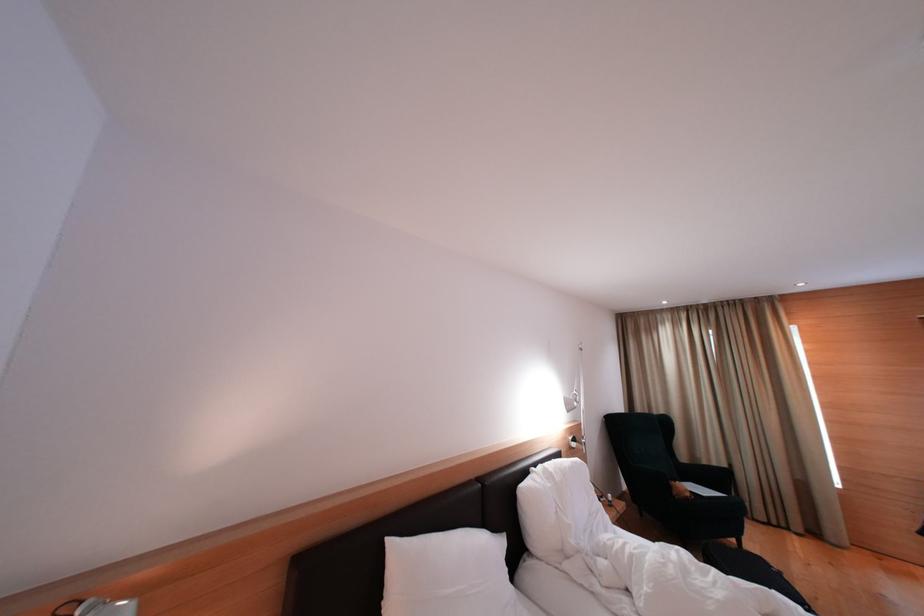
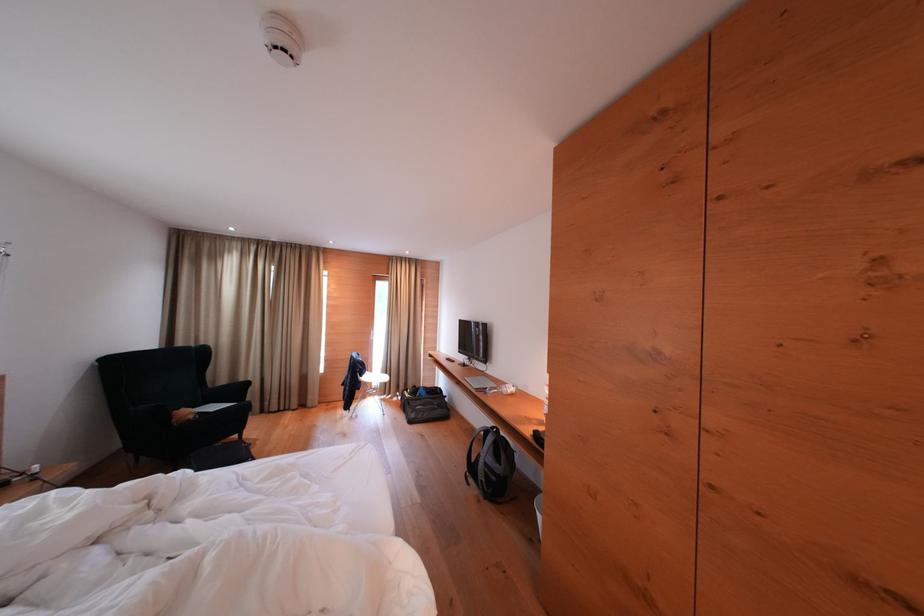
Find the pixel in the second image that matches (x=696, y=499) in the first image.

(198, 421)